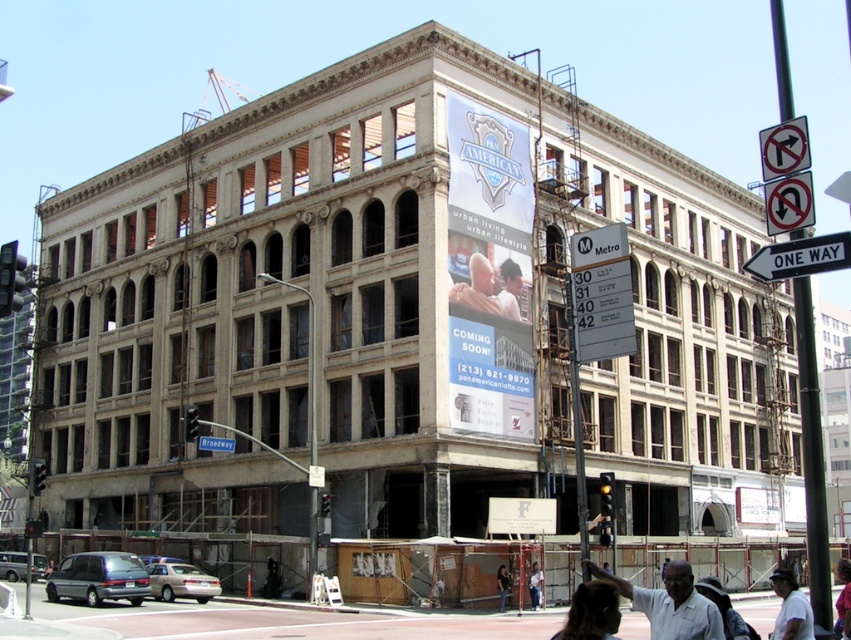
You are a window cleaner standing on a scaffold next to the building. You need to clean the white cotton shirt at lower right and the smooth beige shirt at center. Which shirt will require you to climb higher to reach?

The white cotton shirt at lower right is much taller than the smooth beige shirt at center, so you will need to climb higher to reach the white cotton shirt at lower right.

What is the exact coordinate of the white paper sign at center?

The white paper sign at center is located at point (x=521, y=515).

You are a construction worker standing at the base of the building. You need to reach the white paper sign at center to check its content. Can you safely climb up to it using the scaffolding provided?

The white paper sign at center is 53.57 meters from the camera, so it is too far to reach safely using the scaffolding provided. You should use a lift or other equipment to access it safely.